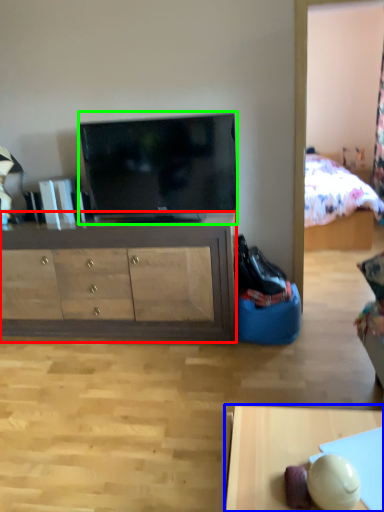
Question: Which is nearer to the cabinetry (highlighted by a red box)? desk (highlighted by a blue box) or television (highlighted by a green box).

Choices:
 (A) desk
 (B) television

Answer: (B)